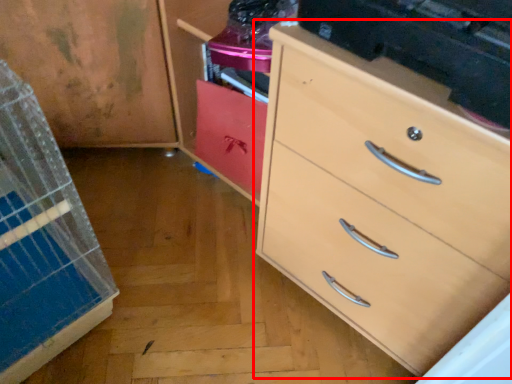
Question: From the image, what is the correct spatial relationship of chest of drawers (annotated by the red box) in relation to cabinetry?

Choices:
 (A) right
 (B) left

Answer: (A)